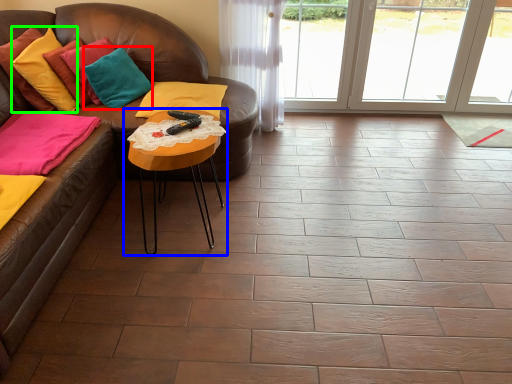
Question: Which object is the farthest from pillow (highlighted by a red box)? Choose among these: table (highlighted by a blue box) or pillow (highlighted by a green box).

Choices:
 (A) table
 (B) pillow

Answer: (A)